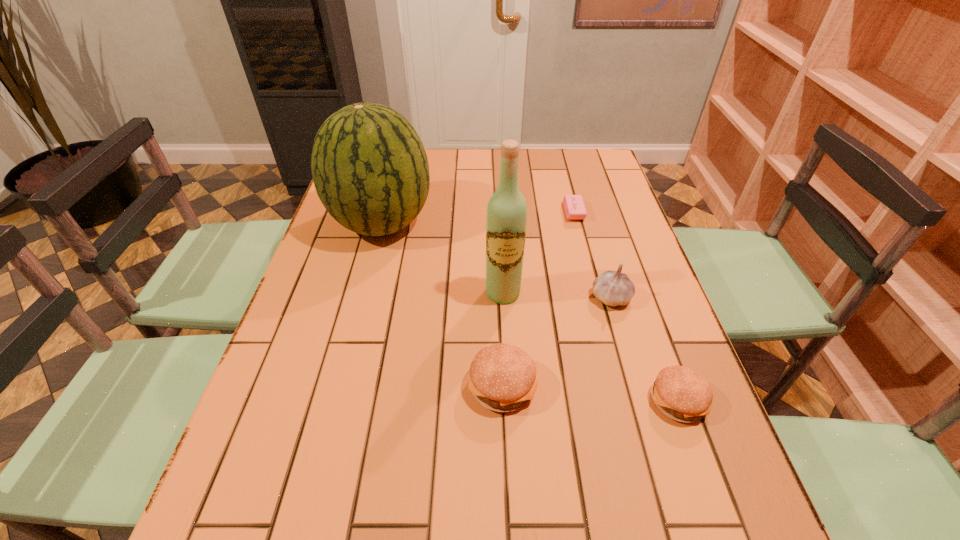
You are a GUI agent. You are given a task and a screenshot of the screen. Output one action in this format:
    pyautogui.click(x=<x>, y=<y>)
    Task: Click on the vacant space located on the front of the fifth tallest object
    The image size is (960, 540).
    Given the screenshot: What is the action you would take?
    pyautogui.click(x=697, y=456)

Locate an element on the screen. blank space located on the front of the eraser is located at coordinates (585, 255).

You are a GUI agent. You are given a task and a screenshot of the screen. Output one action in this format:
    pyautogui.click(x=<x>, y=<y>)
    Task: Click on the vacant space located on the front-facing side of the wine bottle
    The width and height of the screenshot is (960, 540).
    Given the screenshot: What is the action you would take?
    pyautogui.click(x=510, y=421)

Find the location of a particular element. This screenshot has width=960, height=540. vacant space located 0.080m on the right of the fifth shortest object is located at coordinates 461,223.

Where is `free spot located on the back of the fourth shortest object`? free spot located on the back of the fourth shortest object is located at coordinates (601, 261).

At what (x,y) coordinates should I click in order to perform the action: click on object that is at the left edge. Please return your answer as a coordinate pair (x, y). The height and width of the screenshot is (540, 960). Looking at the image, I should click on (370, 170).

This screenshot has width=960, height=540. What are the coordinates of `hamburger that is at the right edge` in the screenshot? It's located at (682, 394).

Identify the location of eraser that is at the right edge. This screenshot has width=960, height=540. (574, 206).

At what (x,y) coordinates should I click in order to perform the action: click on garlic that is positioned at the right edge. Please return your answer as a coordinate pair (x, y). Image resolution: width=960 pixels, height=540 pixels. Looking at the image, I should click on (613, 288).

In the image, there is a desktop. At what (x,y) coordinates should I click in order to perform the action: click on blank space at the far edge. Please return your answer as a coordinate pair (x, y). Looking at the image, I should click on (478, 180).